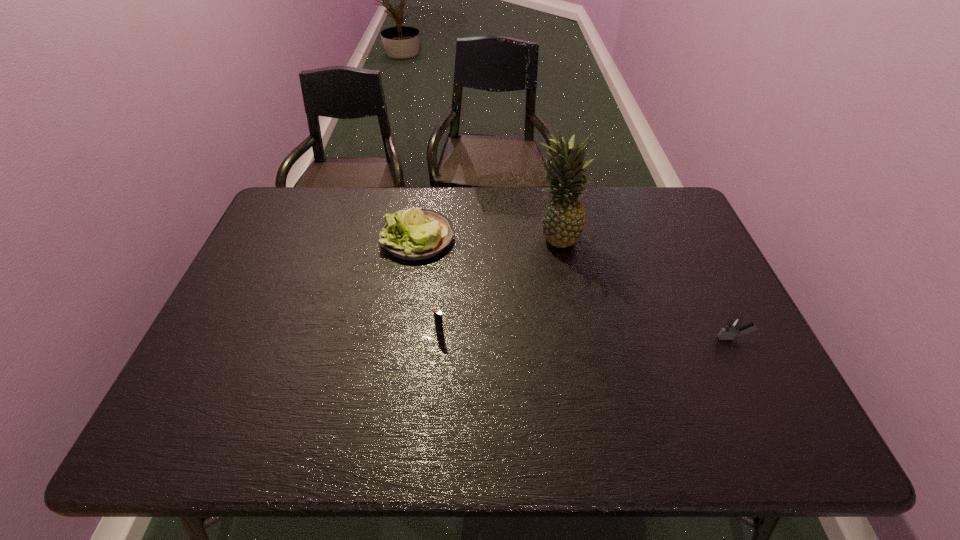
In order to click on lettuce at the far edge in this screenshot , I will do `click(414, 234)`.

You are a GUI agent. You are given a task and a screenshot of the screen. Output one action in this format:
    pyautogui.click(x=<x>, y=<y>)
    Task: Click on the object that is at the right edge
    The width and height of the screenshot is (960, 540).
    Given the screenshot: What is the action you would take?
    pyautogui.click(x=734, y=325)

Find the location of a particular element. This screenshot has width=960, height=540. free location at the far edge of the desktop is located at coordinates (486, 186).

I want to click on vacant space at the near edge, so click(528, 447).

Find the location of `vacant space at the left edge`. vacant space at the left edge is located at coordinates (242, 316).

The image size is (960, 540). In the image, there is a desktop. Find the location of `blank space at the far right corner`. blank space at the far right corner is located at coordinates (651, 227).

Identify the location of unoccupied area between the right igniter and the tallest object. Image resolution: width=960 pixels, height=540 pixels. (644, 287).

Find the location of a particular element. empty location between the pineapple and the right igniter is located at coordinates (644, 287).

This screenshot has height=540, width=960. I want to click on vacant point located between the pineapple and the lettuce, so click(x=487, y=237).

The image size is (960, 540). I want to click on vacant region between the lettuce and the left igniter, so (x=428, y=284).